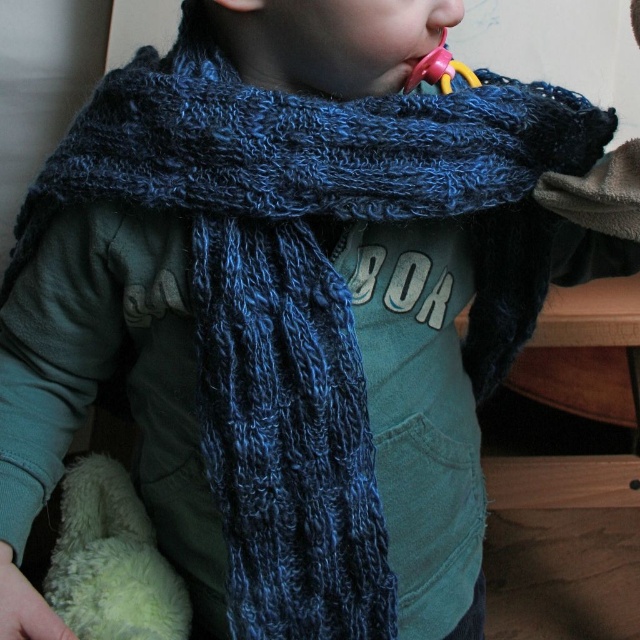
You are a photographer adjusting the focus on your camera. You notice the child has a rubberized yellow and pink toy at mouth. Where exactly is this toy positioned in the image?

The rubberized yellow and pink toy at mouth is located at point (x=440, y=70) in the image.

You are a photographer trying to capture the child in the image. To ensure the rubberized yellow and pink toy at mouth and the smooth skin nose at upper center are both in focus, which object should you prioritize focusing on first?

The rubberized yellow and pink toy at mouth is taller than the smooth skin nose at upper center, so you should focus on the rubberized yellow and pink toy at mouth first because it is larger and more prominent.